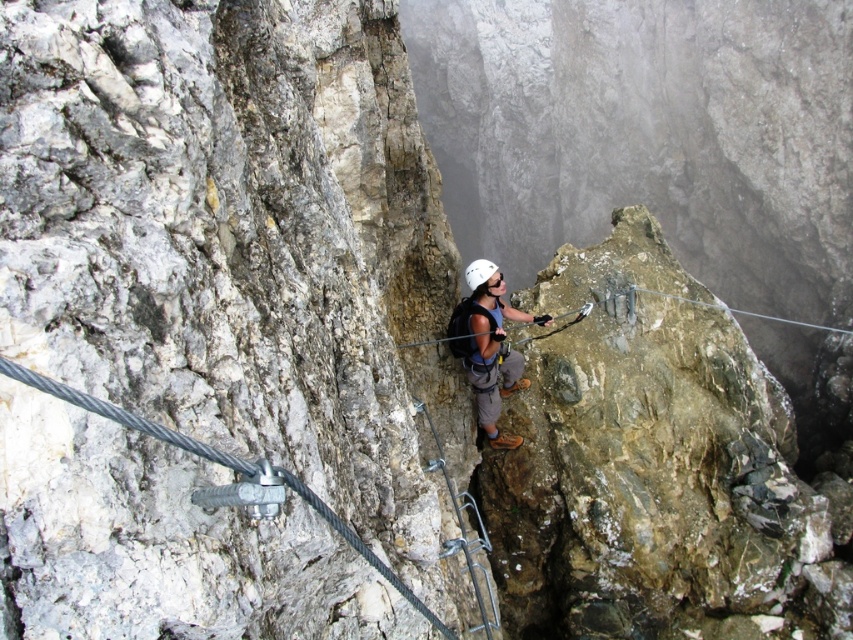
Between metallic wire at center and white matte helmet at center, which one appears on the right side from the viewer's perspective?

white matte helmet at center

Between metallic wire at center and white matte helmet at center, which one is positioned higher?

white matte helmet at center

Who is more distant from viewer, (x=258, y=465) or (x=476, y=272)?

Positioned behind is point (x=476, y=272).

Where is `metallic wire at center`? Image resolution: width=853 pixels, height=640 pixels. metallic wire at center is located at coordinates (230, 483).

Which of these two, matte blue shirt at center or white matte helmet at center, stands taller?

With more height is matte blue shirt at center.

Is matte blue shirt at center thinner than white matte helmet at center?

In fact, matte blue shirt at center might be wider than white matte helmet at center.

Is point (469, 372) positioned in front of point (468, 285)?

No, it is not.

Find the location of a particular element. This screenshot has height=640, width=853. matte blue shirt at center is located at coordinates (491, 346).

Who is lower down, metallic wire at center or matte blue shirt at center?

metallic wire at center is lower down.

Does metallic wire at center appear on the left side of matte blue shirt at center?

Yes, metallic wire at center is to the left of matte blue shirt at center.

Describe the element at coordinates (230, 483) in the screenshot. The image size is (853, 640). I see `metallic wire at center` at that location.

This screenshot has height=640, width=853. I want to click on metallic wire at center, so click(x=230, y=483).